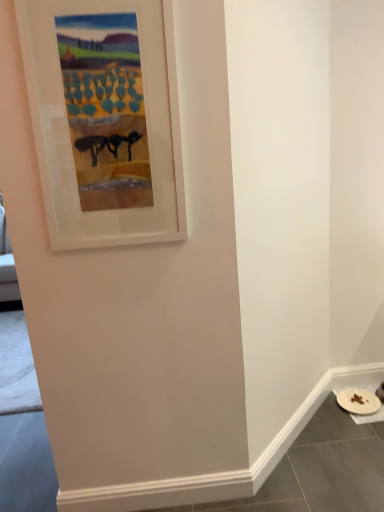
What is the approximate height of wooden picture frame at upper left?

The height of wooden picture frame at upper left is 30.53 inches.

What do you see at coordinates (73, 161) in the screenshot? This screenshot has height=512, width=384. I see `wooden picture frame at upper left` at bounding box center [73, 161].

Locate an element on the screen. wooden picture frame at upper left is located at coordinates (73, 161).

Describe the element at coordinates (358, 401) in the screenshot. I see `white matte plate at lower right` at that location.

Where is `white matte plate at lower right`? This screenshot has width=384, height=512. white matte plate at lower right is located at coordinates (358, 401).

This screenshot has height=512, width=384. I want to click on wooden picture frame at upper left, so click(73, 161).

Is white matte plate at lower right to the right of wooden picture frame at upper left from the viewer's perspective?

Correct, you'll find white matte plate at lower right to the right of wooden picture frame at upper left.

In the image, is white matte plate at lower right positioned in front of or behind wooden picture frame at upper left?

white matte plate at lower right is behind wooden picture frame at upper left.

Is point (364, 394) less distant than point (21, 47)?

That is False.

From the image's perspective, who appears lower, white matte plate at lower right or wooden picture frame at upper left?

white matte plate at lower right, from the image's perspective.

From a real-world perspective, is white matte plate at lower right positioned over wooden picture frame at upper left based on gravity?

No, from a real-world perspective, white matte plate at lower right is not over wooden picture frame at upper left

Considering the relative sizes of white matte plate at lower right and wooden picture frame at upper left in the image provided, is white matte plate at lower right thinner than wooden picture frame at upper left?

In fact, white matte plate at lower right might be wider than wooden picture frame at upper left.

Does white matte plate at lower right have a greater height compared to wooden picture frame at upper left?

In fact, white matte plate at lower right may be shorter than wooden picture frame at upper left.

Considering the sizes of objects white matte plate at lower right and wooden picture frame at upper left in the image provided, who is smaller, white matte plate at lower right or wooden picture frame at upper left?

Smaller between the two is white matte plate at lower right.

Would you say white matte plate at lower right contains wooden picture frame at upper left?

No, white matte plate at lower right does not contain wooden picture frame at upper left.

Is white matte plate at lower right in contact with wooden picture frame at upper left?

They are not placed beside each other.

Is white matte plate at lower right turned away from wooden picture frame at upper left?

No, white matte plate at lower right is not facing the opposite direction of wooden picture frame at upper left.

Measure the distance from white matte plate at lower right to wooden picture frame at upper left.

white matte plate at lower right and wooden picture frame at upper left are 1.71 meters apart from each other.

Locate an element on the screen. This screenshot has height=512, width=384. picture frame that appears above the white matte plate at lower right (from the image's perspective) is located at coordinates (73, 161).

Is wooden picture frame at upper left at the right side of white matte plate at lower right?

No, wooden picture frame at upper left is not to the right of white matte plate at lower right.

Considering the relative positions of wooden picture frame at upper left and white matte plate at lower right in the image provided, is wooden picture frame at upper left behind white matte plate at lower right?

No, it is not.

Which point is more distant from viewer, (181, 151) or (349, 395)?

Positioned behind is point (349, 395).

From the image's perspective, would you say wooden picture frame at upper left is shown under white matte plate at lower right?

Actually, wooden picture frame at upper left appears above white matte plate at lower right in the image.

From a real-world perspective, is wooden picture frame at upper left positioned above or below white matte plate at lower right?

Clearly, from a real-world perspective, wooden picture frame at upper left is above white matte plate at lower right.

Considering the relative sizes of wooden picture frame at upper left and white matte plate at lower right in the image provided, is wooden picture frame at upper left thinner than white matte plate at lower right?

Yes.

From their relative heights in the image, would you say wooden picture frame at upper left is taller or shorter than white matte plate at lower right?

wooden picture frame at upper left is taller than white matte plate at lower right.

Considering the sizes of objects wooden picture frame at upper left and white matte plate at lower right in the image provided, who is smaller, wooden picture frame at upper left or white matte plate at lower right?

With smaller size is white matte plate at lower right.

Which is correct: wooden picture frame at upper left is inside white matte plate at lower right, or outside of it?

The correct answer is: outside.

Are wooden picture frame at upper left and white matte plate at lower right beside each other?

No, wooden picture frame at upper left is not in contact with white matte plate at lower right.

Is wooden picture frame at upper left facing away from white matte plate at lower right?

wooden picture frame at upper left is not turned away from white matte plate at lower right.

Can you tell me how much wooden picture frame at upper left and white matte plate at lower right differ in facing direction?

There is a 2.79-degree angle between the facing directions of wooden picture frame at upper left and white matte plate at lower right.

I want to click on picture frame above the white matte plate at lower right (from a real-world perspective), so click(73, 161).

Locate an element on the screen. The image size is (384, 512). platter to the right of wooden picture frame at upper left is located at coordinates (358, 401).

At what (x,y) coordinates should I click in order to perform the action: click on picture frame that is above the white matte plate at lower right (from the image's perspective). Please return your answer as a coordinate pair (x, y). Looking at the image, I should click on (73, 161).